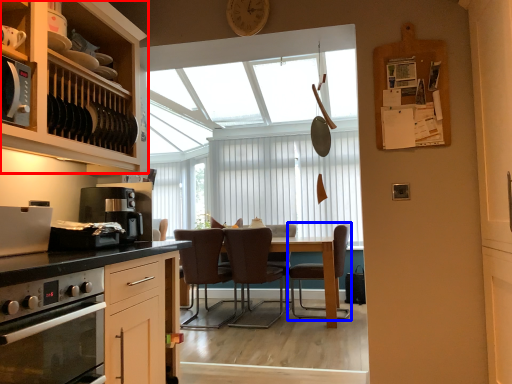
Question: Which point is closer to the camera, cabinetry (highlighted by a red box) or chair (highlighted by a blue box)?

Choices:
 (A) cabinetry
 (B) chair

Answer: (A)